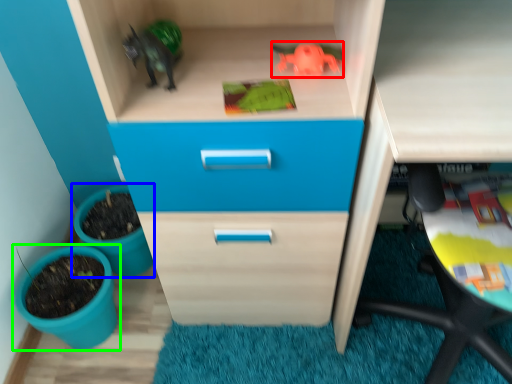
Question: Based on their relative distances, which object is nearer to toy (highlighted by a red box)? Choose from flowerpot (highlighted by a blue box) and flowerpot (highlighted by a green box).

Choices:
 (A) flowerpot
 (B) flowerpot

Answer: (A)